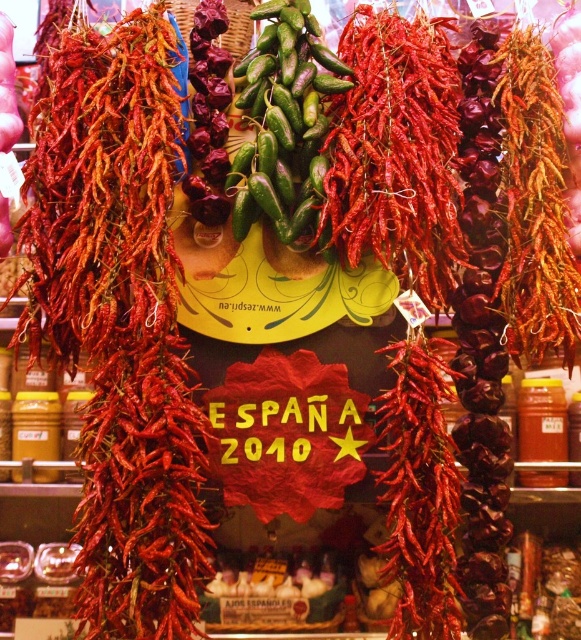
Can you confirm if dried red pepper at center is taller than green glossy jalapeños at center?

Correct, dried red pepper at center is much taller as green glossy jalapeños at center.

Does dried red pepper at center come in front of green glossy jalapeños at center?

Yes, it is in front of green glossy jalapeños at center.

The height and width of the screenshot is (640, 581). In order to click on dried red pepper at center in this screenshot , I will do `click(121, 323)`.

At what (x,y) coordinates should I click in order to perform the action: click on dried red pepper at center. Please return your answer as a coordinate pair (x, y). This screenshot has width=581, height=640. Looking at the image, I should click on (121, 323).